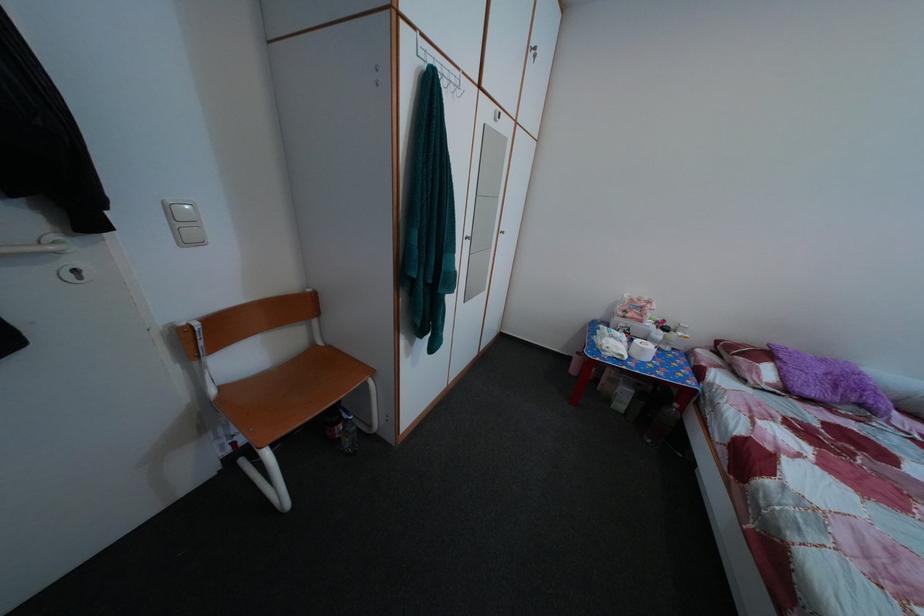
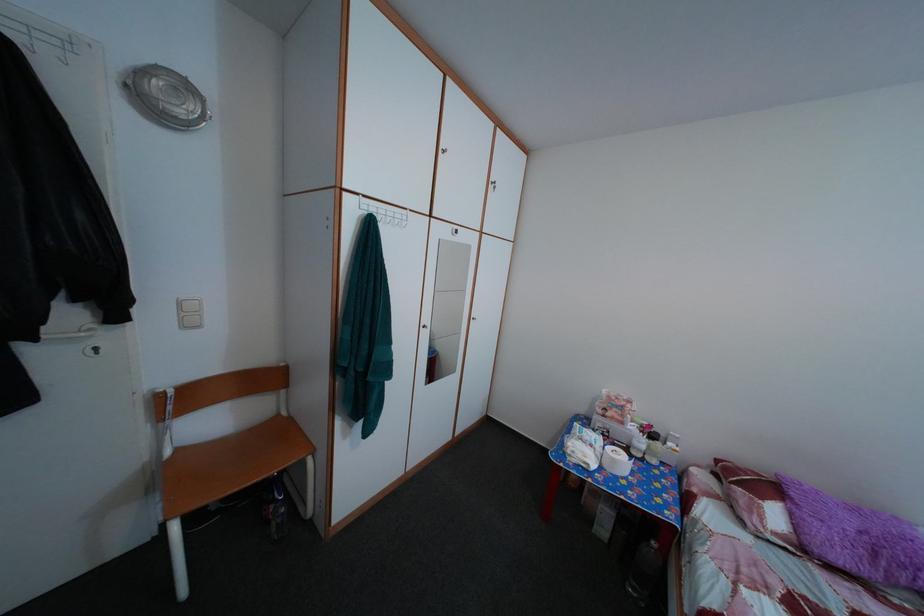
Question: What movement of the cameraman would produce the second image?

Choices:
 (A) Left
 (B) Right
 (C) Forward
 (D) Backward

Answer: (B)